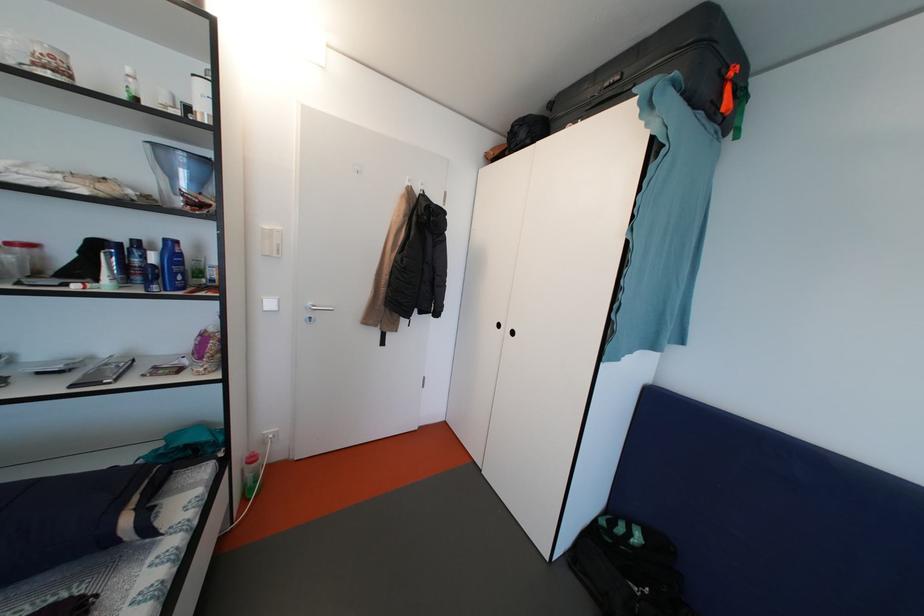
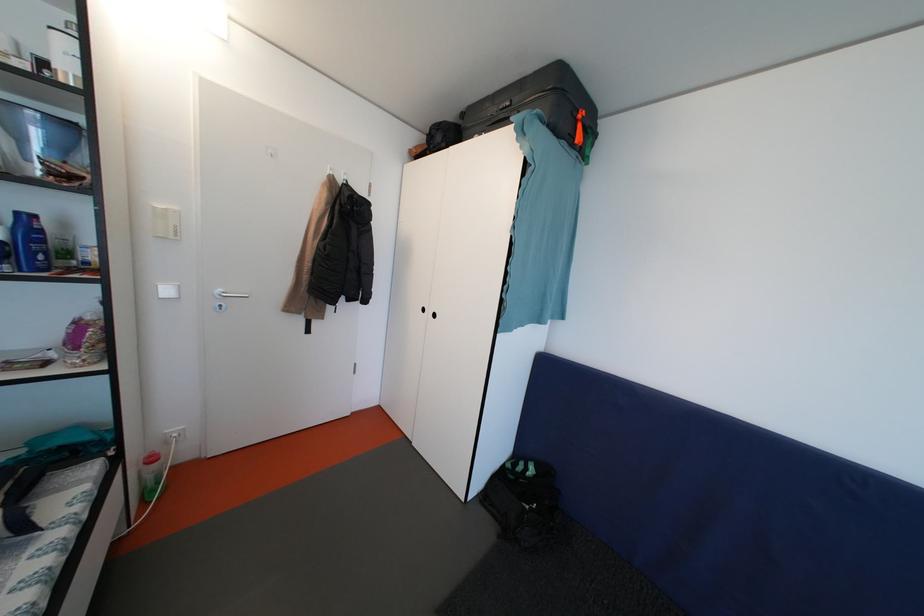
In the second image, find the point that corresponds to point 274,233 in the first image.

(166, 211)